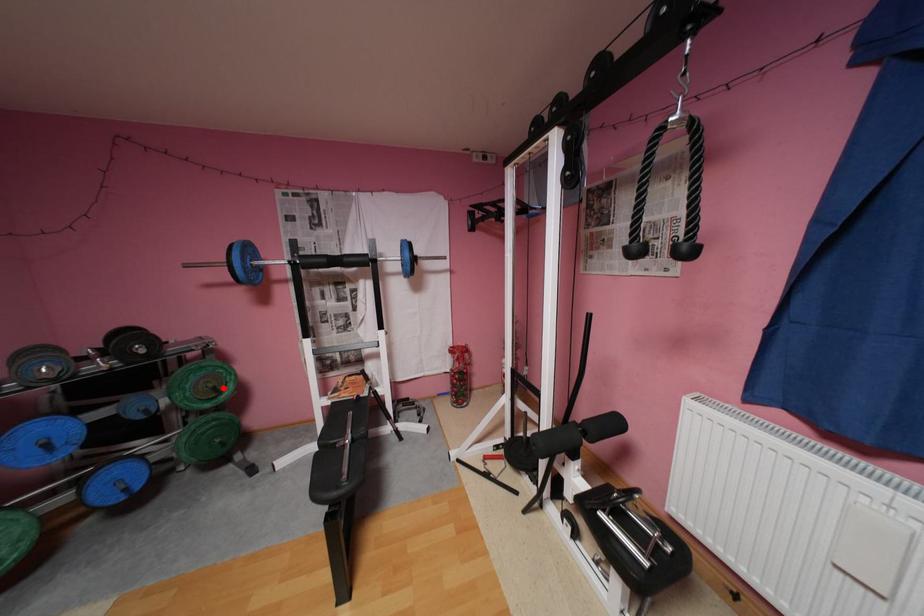
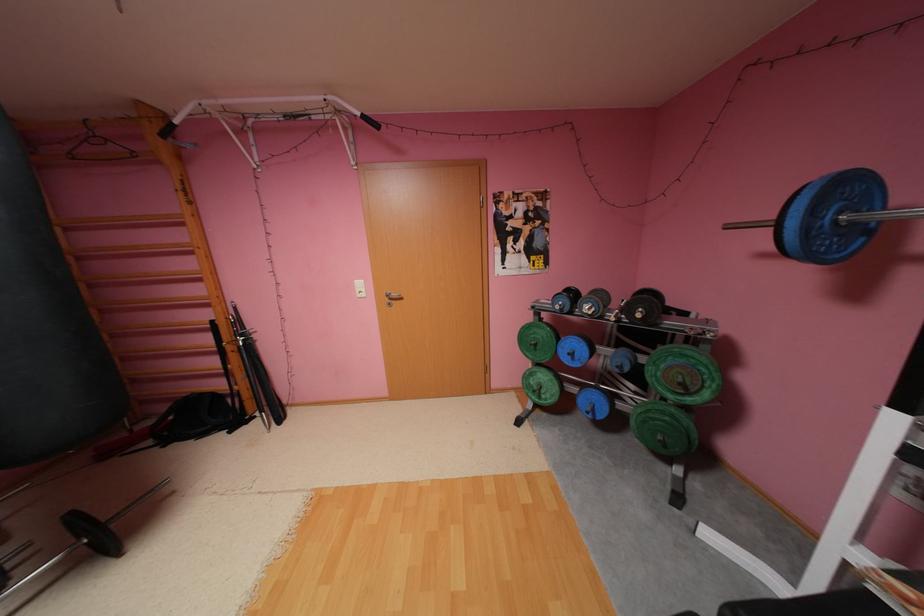
The point at the highlighted location is marked in the first image. Where is the corresponding point in the second image?

(690, 384)